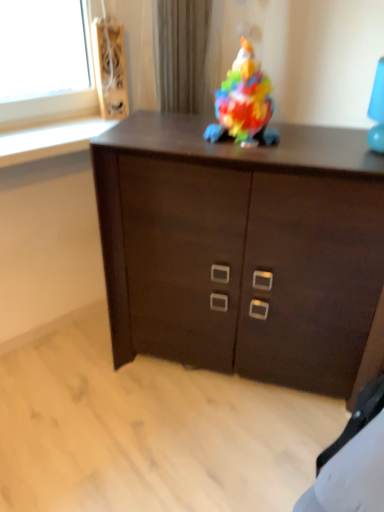
The width and height of the screenshot is (384, 512). I want to click on dark wood cabinet at center, so (241, 248).

Locate an element on the screen. The image size is (384, 512). multicolored plastic toy at center is located at coordinates (244, 103).

Find the location of a particular element. The width and height of the screenshot is (384, 512). dark wood cabinet at center is located at coordinates (241, 248).

From a real-world perspective, who is located higher, wooden speaker at upper left or dark wood cabinet at center?

wooden speaker at upper left is physically above.

Measure the distance from wooden speaker at upper left to dark wood cabinet at center.

wooden speaker at upper left is 76.38 centimeters from dark wood cabinet at center.

Looking at this image, who is taller, wooden speaker at upper left or dark wood cabinet at center?

With more height is dark wood cabinet at center.

Is wooden speaker at upper left completely or partially outside of dark wood cabinet at center?

wooden speaker at upper left is positioned outside dark wood cabinet at center.

From a real-world perspective, relative to wooden speaker at upper left, is multicolored plastic toy at center vertically above or below?

Clearly, from a real-world perspective, multicolored plastic toy at center is below wooden speaker at upper left.

Is multicolored plastic toy at center positioned with its back to wooden speaker at upper left?

No, multicolored plastic toy at center is not facing the opposite direction of wooden speaker at upper left.

Who is taller, multicolored plastic toy at center or wooden speaker at upper left?

With more height is wooden speaker at upper left.

Does multicolored plastic toy at center come in front of wooden speaker at upper left?

Yes.

From a real-world perspective, does dark wood cabinet at center stand above wooden speaker at upper left?

No.

Are dark wood cabinet at center and wooden speaker at upper left located far from each other?

Actually, dark wood cabinet at center and wooden speaker at upper left are a little close together.

Locate an element on the screen. speaker that is behind the dark wood cabinet at center is located at coordinates pyautogui.click(x=110, y=68).

Considering the sizes of dark wood cabinet at center and wooden speaker at upper left in the image, is dark wood cabinet at center wider or thinner than wooden speaker at upper left?

In the image, dark wood cabinet at center appears to be wider than wooden speaker at upper left.

Is multicolored plastic toy at center at the left side of dark wood cabinet at center?

Yes, multicolored plastic toy at center is to the left of dark wood cabinet at center.

Are multicolored plastic toy at center and dark wood cabinet at center making contact?

No, multicolored plastic toy at center is not with dark wood cabinet at center.

Can you confirm if multicolored plastic toy at center is taller than dark wood cabinet at center?

Incorrect, the height of multicolored plastic toy at center is not larger of that of dark wood cabinet at center.

In the image, is multicolored plastic toy at center positioned in front of or behind dark wood cabinet at center?

Visually, multicolored plastic toy at center is located behind dark wood cabinet at center.

Between wooden speaker at upper left and multicolored plastic toy at center, which one has larger width?

multicolored plastic toy at center is wider.

Which of these two, wooden speaker at upper left or multicolored plastic toy at center, is smaller?

wooden speaker at upper left.

Which is behind, wooden speaker at upper left or multicolored plastic toy at center?

Positioned behind is wooden speaker at upper left.

From their relative heights in the image, would you say wooden speaker at upper left is taller or shorter than multicolored plastic toy at center?

In the image, wooden speaker at upper left appears to be taller than multicolored plastic toy at center.

Which is more to the left, dark wood cabinet at center or multicolored plastic toy at center?

From the viewer's perspective, multicolored plastic toy at center appears more on the left side.

Image resolution: width=384 pixels, height=512 pixels. In order to click on toy that is behind the dark wood cabinet at center in this screenshot , I will do `click(244, 103)`.

Is dark wood cabinet at center oriented towards multicolored plastic toy at center?

No.

What's the angular difference between dark wood cabinet at center and multicolored plastic toy at center's facing directions?

6.5 degrees separate the facing orientations of dark wood cabinet at center and multicolored plastic toy at center.

Find the location of a particular element. The height and width of the screenshot is (512, 384). the chest of drawers that is below the wooden speaker at upper left (from the image's perspective) is located at coordinates (241, 248).

Where is `speaker behind the multicolored plastic toy at center`? speaker behind the multicolored plastic toy at center is located at coordinates (110, 68).

Estimate the real-world distances between objects in this image. Which object is closer to dark wood cabinet at center, wooden speaker at upper left or multicolored plastic toy at center?

multicolored plastic toy at center is positioned closer to the anchor dark wood cabinet at center.

Based on their spatial positions, is dark wood cabinet at center or wooden speaker at upper left closer to multicolored plastic toy at center?

dark wood cabinet at center is closer to multicolored plastic toy at center.

Which object lies nearer to the anchor point multicolored plastic toy at center, wooden speaker at upper left or dark wood cabinet at center?

Among the two, dark wood cabinet at center is located nearer to multicolored plastic toy at center.

From the image, which object appears to be nearer to wooden speaker at upper left, dark wood cabinet at center or multicolored plastic toy at center?

multicolored plastic toy at center lies closer to wooden speaker at upper left than the other object.

Looking at this image, when comparing their distances from dark wood cabinet at center, does multicolored plastic toy at center or wooden speaker at upper left seem closer?

multicolored plastic toy at center is positioned closer to the anchor dark wood cabinet at center.

Which object lies further to the anchor point wooden speaker at upper left, multicolored plastic toy at center or dark wood cabinet at center?

Based on the image, dark wood cabinet at center appears to be further to wooden speaker at upper left.

At what (x,y) coordinates should I click in order to perform the action: click on toy between wooden speaker at upper left and dark wood cabinet at center in the vertical direction. Please return your answer as a coordinate pair (x, y). Looking at the image, I should click on (244, 103).